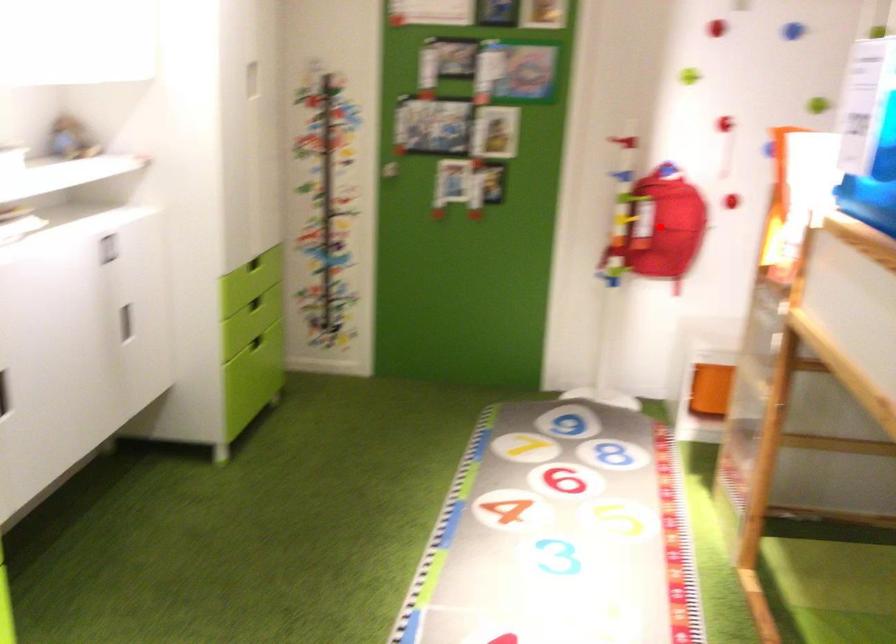
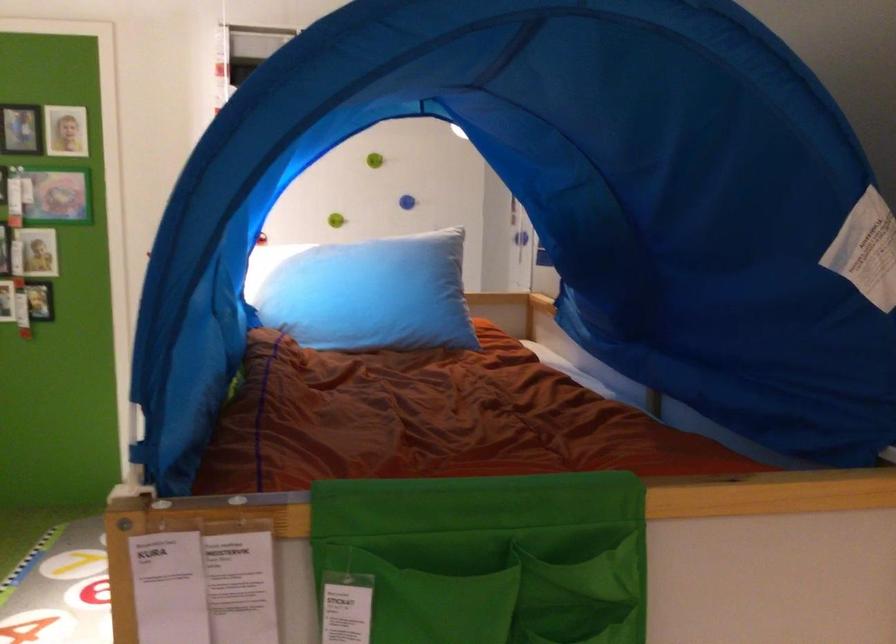
Question: I am providing you with two images of the same scene from different viewpoints. A red point is marked on the first image. Is the red point's position out of view in image 2?

Choices:
 (A) Yes
 (B) No

Answer: (A)